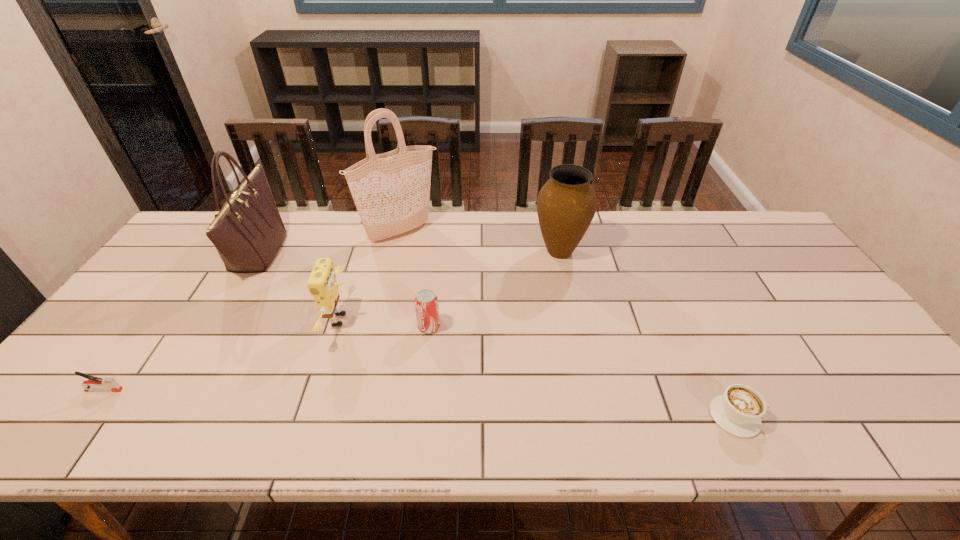
Find the location of a particular element. This screenshot has width=960, height=540. cappuccino is located at coordinates (739, 411).

Locate an element on the screen. The image size is (960, 540). blank space located 0.170m on the right of the shopping bag is located at coordinates (490, 232).

Where is `free location located 0.060m on the front-facing side of the second tallest object`? free location located 0.060m on the front-facing side of the second tallest object is located at coordinates (299, 252).

Locate an element on the screen. free space located on the right of the urn is located at coordinates (615, 251).

I want to click on free space located 0.320m on the face of the sponge, so click(471, 320).

Locate an element on the screen. The image size is (960, 540). free space located on the logo side of the fifth tallest object is located at coordinates (557, 327).

Identify the location of free spot located on the handle side of the second nearest object. The image size is (960, 540). (251, 390).

This screenshot has width=960, height=540. What are the coordinates of `free space located 0.350m to the right of the rightmost object's handle` in the screenshot? It's located at (919, 416).

Image resolution: width=960 pixels, height=540 pixels. I want to click on shopping bag that is at the far edge, so coord(391,191).

You are a GUI agent. You are given a task and a screenshot of the screen. Output one action in this format:
    pyautogui.click(x=<x>, y=<y>)
    Task: Click on the handbag present at the far edge
    
    Given the screenshot: What is the action you would take?
    pyautogui.click(x=248, y=231)